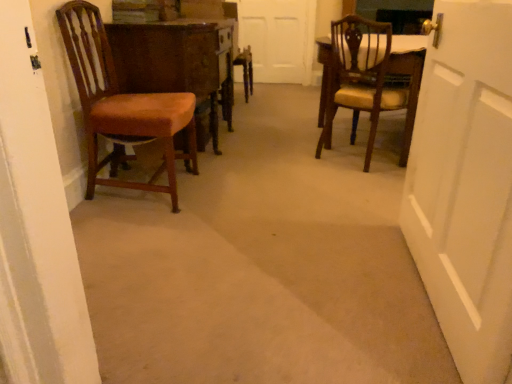
This screenshot has width=512, height=384. What do you see at coordinates (177, 62) in the screenshot?
I see `wooden polished table at left` at bounding box center [177, 62].

The image size is (512, 384). What are the coordinates of `wooden polished table at left` in the screenshot? It's located at (177, 62).

What are the coordinates of `matte brown chair at right, which is the second chair from left to right` in the screenshot? It's located at (368, 79).

In order to click on matte brown chair at left, the 2th chair when ordered from right to left in this screenshot , I will do 122,105.

Is point (343, 32) positioned before point (161, 186)?

No, it is behind (161, 186).

Measure the distance from matte brown chair at right, which is the second chair from left to right, to matte brown chair at left, which ranks as the 1th chair in left-to-right order.

3.77 feet.

In the scene shown: Could you tell me if matte brown chair at right, the 1th chair when ordered from right to left, is turned towards matte brown chair at left, which ranks as the 1th chair in left-to-right order?

No, matte brown chair at right, the 1th chair when ordered from right to left, does not turn towards matte brown chair at left, which ranks as the 1th chair in left-to-right order.

Based on their sizes in the image, would you say matte brown chair at right, the 1th chair when ordered from right to left, is bigger or smaller than matte brown chair at left, the 2th chair when ordered from right to left?

Considering their sizes, matte brown chair at right, the 1th chair when ordered from right to left, takes up less space than matte brown chair at left, the 2th chair when ordered from right to left.

From a real-world perspective, does wooden polished table at left stand above matte brown chair at left, the 2th chair when ordered from right to left?

No.

In the scene shown: In terms of width, does wooden polished table at left look wider or thinner when compared to matte brown chair at left, the 2th chair when ordered from right to left?

In the image, wooden polished table at left appears to be wider than matte brown chair at left, the 2th chair when ordered from right to left.

Which is more distant, (232,87) or (68,40)?

The point (232,87) is farther.

Which of these two, wooden polished table at left or matte brown chair at left, the 2th chair when ordered from right to left, stands taller?

matte brown chair at left, the 2th chair when ordered from right to left.

What's the angular difference between matte brown chair at left, the 2th chair when ordered from right to left, and matte brown chair at right, the 1th chair when ordered from right to left,'s facing directions?

53.5 degrees separate the facing orientations of matte brown chair at left, the 2th chair when ordered from right to left, and matte brown chair at right, the 1th chair when ordered from right to left.

Is matte brown chair at right, which is the second chair from left to right, surrounded by matte brown chair at left, which ranks as the 1th chair in left-to-right order?

No, matte brown chair at right, which is the second chair from left to right, is not a part of matte brown chair at left, which ranks as the 1th chair in left-to-right order.

Identify the location of chair above the matte brown chair at left, which ranks as the 1th chair in left-to-right order (from the image's perspective). This screenshot has height=384, width=512. (368, 79).

Looking at the image, does matte brown chair at left, which ranks as the 1th chair in left-to-right order, seem bigger or smaller compared to matte brown chair at right, the 1th chair when ordered from right to left?

Considering their sizes, matte brown chair at left, which ranks as the 1th chair in left-to-right order, takes up more space than matte brown chair at right, the 1th chair when ordered from right to left.

Relative to wooden polished table at left, is matte brown chair at right, which is the second chair from left to right, in front or behind?

matte brown chair at right, which is the second chair from left to right, is positioned closer to the viewer than wooden polished table at left.

Is matte brown chair at right, which is the second chair from left to right, smaller than wooden polished table at left?

Indeed, matte brown chair at right, which is the second chair from left to right, has a smaller size compared to wooden polished table at left.

Could you tell me if matte brown chair at right, the 1th chair when ordered from right to left, is facing wooden polished table at left?

No, matte brown chair at right, the 1th chair when ordered from right to left, is not turned towards wooden polished table at left.

Which is in front, point (341, 49) or point (175, 82)?

The point (175, 82) is in front.

Consider the image. How different are the orientations of wooden polished table at left and matte brown chair at right, the 1th chair when ordered from right to left, in degrees?

53.6 degrees separate the facing orientations of wooden polished table at left and matte brown chair at right, the 1th chair when ordered from right to left.

Who is taller, wooden polished table at left or matte brown chair at right, which is the second chair from left to right?

matte brown chair at right, which is the second chair from left to right, is taller.

From the image's perspective, who appears lower, wooden polished table at left or matte brown chair at right, which is the second chair from left to right?

From the image's view, matte brown chair at right, which is the second chair from left to right, is below.

The height and width of the screenshot is (384, 512). What are the coordinates of `table that appears above the matte brown chair at right, the 1th chair when ordered from right to left (from the image's perspective)` in the screenshot? It's located at (x=177, y=62).

Is matte brown chair at left, the 2th chair when ordered from right to left, taller than wooden polished table at left?

Correct, matte brown chair at left, the 2th chair when ordered from right to left, is much taller as wooden polished table at left.

Between matte brown chair at left, which ranks as the 1th chair in left-to-right order, and wooden polished table at left, which one appears on the left side from the viewer's perspective?

Positioned to the left is matte brown chair at left, which ranks as the 1th chair in left-to-right order.

What are the coordinates of `the 2nd chair in front of the wooden polished table at left, starting your count from the anchor` in the screenshot? It's located at (122, 105).

Is the depth of matte brown chair at left, which ranks as the 1th chair in left-to-right order, less than that of wooden polished table at left?

Yes, matte brown chair at left, which ranks as the 1th chair in left-to-right order, is closer to the viewer.

Is white matte door at center turned away from wooden polished table at left?

No, white matte door at center's orientation is not away from wooden polished table at left.

From the image's perspective, is white matte door at center on wooden polished table at left?

Indeed, from the image's perspective, white matte door at center is shown above wooden polished table at left.

Which object is more forward, white matte door at center or wooden polished table at left?

wooden polished table at left is closer to the camera.

In terms of size, does white matte door at center appear bigger or smaller than wooden polished table at left?

white matte door at center is smaller than wooden polished table at left.

What are the coordinates of `chair above the matte brown chair at right, the 1th chair when ordered from right to left (from a real-world perspective)` in the screenshot? It's located at (122, 105).

What are the coordinates of `table behind the matte brown chair at left, the 2th chair when ordered from right to left` in the screenshot? It's located at (177, 62).

Considering their positions, is matte brown chair at left, which ranks as the 1th chair in left-to-right order, positioned further to matte brown chair at right, the 1th chair when ordered from right to left, than wooden polished table at left?

Based on the image, matte brown chair at left, which ranks as the 1th chair in left-to-right order, appears to be further to matte brown chair at right, the 1th chair when ordered from right to left.

When comparing their distances from white matte door at center, does matte brown chair at right, which is the second chair from left to right, or wooden polished table at left seem closer?

wooden polished table at left is closer to white matte door at center.

In the scene shown: When comparing their distances from matte brown chair at right, which is the second chair from left to right, does white matte door at center or wooden polished table at left seem further?

white matte door at center is further to matte brown chair at right, which is the second chair from left to right.

Considering their positions, is wooden polished table at left positioned closer to white matte door at center than matte brown chair at left, which ranks as the 1th chair in left-to-right order?

The object closer to white matte door at center is wooden polished table at left.

Estimate the real-world distances between objects in this image. Which object is further from matte brown chair at left, the 2th chair when ordered from right to left, white matte door at center or matte brown chair at right, which is the second chair from left to right?

Based on the image, white matte door at center appears to be further to matte brown chair at left, the 2th chair when ordered from right to left.

Which object lies nearer to the anchor point matte brown chair at left, which ranks as the 1th chair in left-to-right order, white matte door at center or wooden polished table at left?

wooden polished table at left lies closer to matte brown chair at left, which ranks as the 1th chair in left-to-right order, than the other object.

When comparing their distances from matte brown chair at left, the 2th chair when ordered from right to left, does matte brown chair at right, which is the second chair from left to right, or wooden polished table at left seem further?

matte brown chair at right, which is the second chair from left to right, lies further to matte brown chair at left, the 2th chair when ordered from right to left, than the other object.

Looking at the image, which one is located further to white matte door at center, matte brown chair at left, the 2th chair when ordered from right to left, or wooden polished table at left?

matte brown chair at left, the 2th chair when ordered from right to left, is positioned further to the anchor white matte door at center.

The height and width of the screenshot is (384, 512). What are the coordinates of `table between matte brown chair at left, which ranks as the 1th chair in left-to-right order, and white matte door at center in the front-back direction` in the screenshot? It's located at (177, 62).

The height and width of the screenshot is (384, 512). What are the coordinates of `table located between matte brown chair at left, which ranks as the 1th chair in left-to-right order, and matte brown chair at right, which is the second chair from left to right, in the left-right direction` in the screenshot? It's located at (177, 62).

At what (x,y) coordinates should I click in order to perform the action: click on chair between matte brown chair at left, which ranks as the 1th chair in left-to-right order, and white matte door at center from front to back. Please return your answer as a coordinate pair (x, y). This screenshot has height=384, width=512. Looking at the image, I should click on (368, 79).

I want to click on table located between matte brown chair at right, which is the second chair from left to right, and white matte door at center in the depth direction, so click(x=177, y=62).